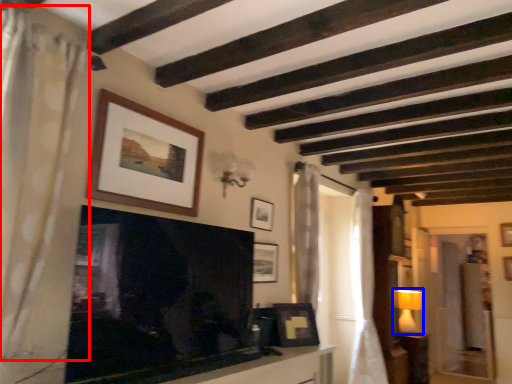
Question: Which of the following is the farthest to the observer, curtain (highlighted by a red box) or lamp (highlighted by a blue box)?

Choices:
 (A) curtain
 (B) lamp

Answer: (B)